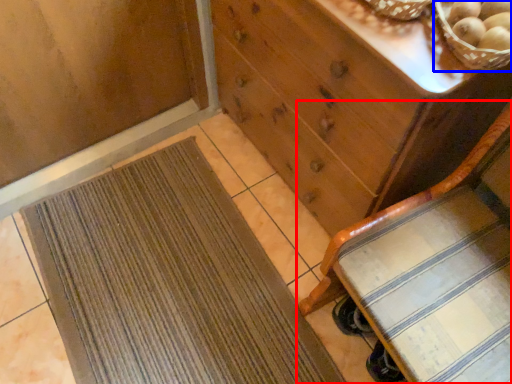
Question: Which point is closer to the camera, furniture (highlighted by a red box) or basket (highlighted by a blue box)?

Choices:
 (A) furniture
 (B) basket

Answer: (A)